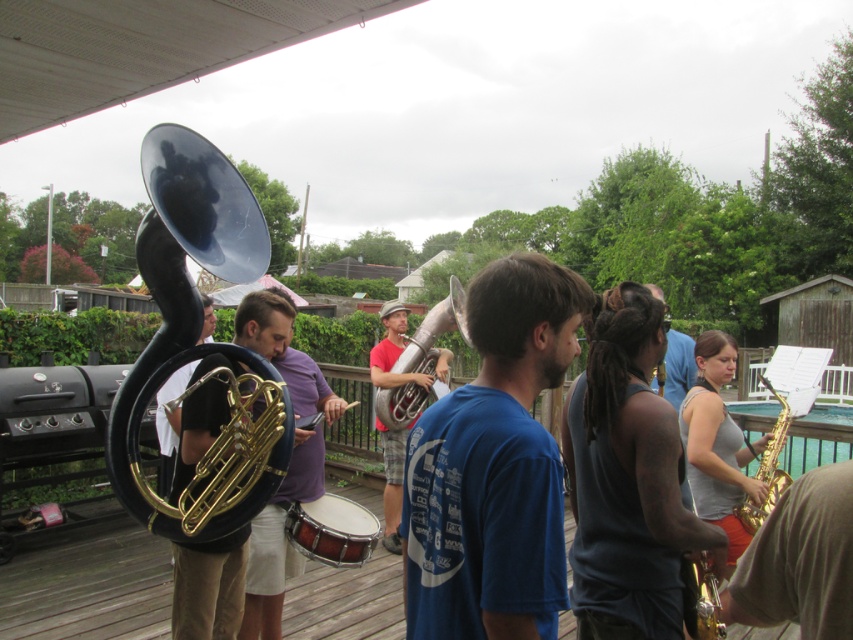
Based on the photo, between blue cotton t-shirt at center and blue shirt at center, which one has less height?

With less height is blue shirt at center.

Does blue cotton t-shirt at center appear on the right side of blue shirt at center?

No, blue cotton t-shirt at center is not to the right of blue shirt at center.

Does point (492, 445) come closer to viewer compared to point (688, 381)?

That is True.

Identify the location of blue cotton t-shirt at center. This screenshot has height=640, width=853. (492, 467).

Does blue cotton t-shirt at center have a lesser width compared to matte gold tuba at center?

In fact, blue cotton t-shirt at center might be wider than matte gold tuba at center.

Is the position of blue cotton t-shirt at center more distant than that of matte gold tuba at center?

That is False.

Who is more forward, (477, 413) or (254, 637)?

Point (477, 413) is in front.

Find the location of a particular element. The width and height of the screenshot is (853, 640). blue cotton t-shirt at center is located at coordinates (492, 467).

Which is below, matte gold tuba at center or gold shiny trumpet at center-right?

gold shiny trumpet at center-right is lower down.

Which is behind, point (279, 552) or point (788, 422)?

Positioned behind is point (788, 422).

Identify the location of matte gold tuba at center. This screenshot has width=853, height=640. (279, 540).